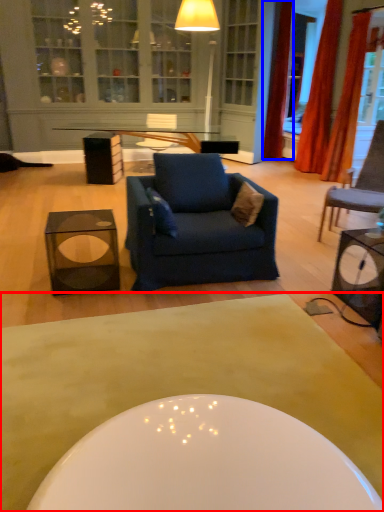
Question: Which object is closer to the camera taking this photo, coffee table (highlighted by a red box) or curtain (highlighted by a blue box)?

Choices:
 (A) coffee table
 (B) curtain

Answer: (A)